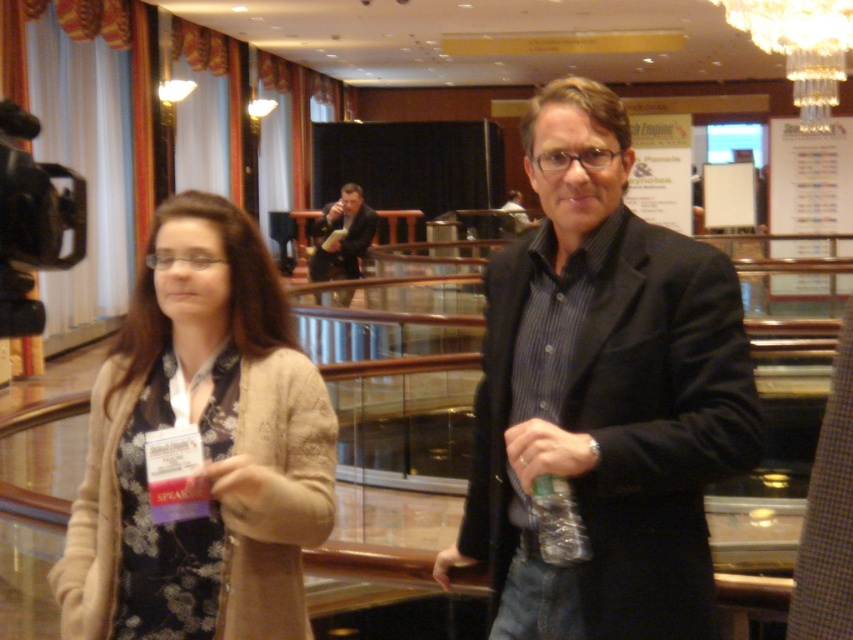
Does black textured blazer at center lie in front of dark suit at center?

Yes, black textured blazer at center is in front of dark suit at center.

Image resolution: width=853 pixels, height=640 pixels. Find the location of `black textured blazer at center`. black textured blazer at center is located at coordinates (602, 394).

What are the coordinates of `black textured blazer at center` in the screenshot? It's located at (602, 394).

Does point (679, 358) come in front of point (519, 211)?

Yes, it is.

Looking at this image, does black textured blazer at center have a lesser height compared to matte black suit at center?

No, black textured blazer at center is not shorter than matte black suit at center.

Where is `black textured blazer at center`? This screenshot has width=853, height=640. black textured blazer at center is located at coordinates (602, 394).

The height and width of the screenshot is (640, 853). What do you see at coordinates (602, 394) in the screenshot? I see `matte black jacket at center` at bounding box center [602, 394].

Where is `matte black jacket at center`? This screenshot has width=853, height=640. matte black jacket at center is located at coordinates (602, 394).